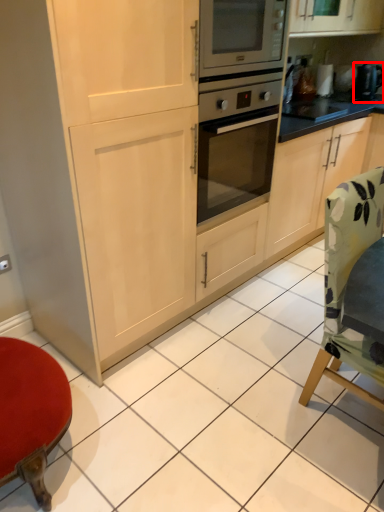
Question: From the image's perspective, where is appliance (annotated by the red box) located relative to chair?

Choices:
 (A) below
 (B) above

Answer: (B)